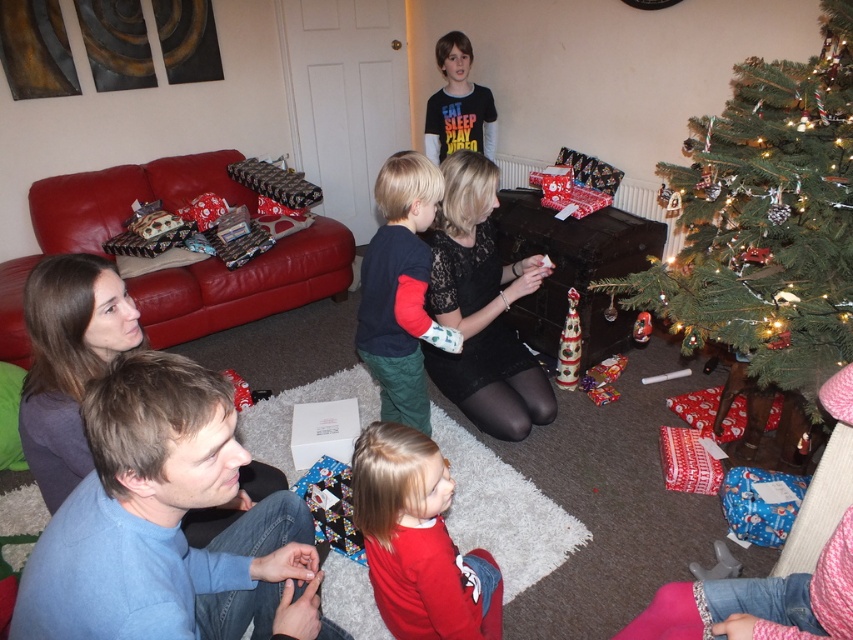
Question: Does matte red shirt at lower center have a smaller size compared to dark blue fleece shirt at center?

Choices:
 (A) yes
 (B) no

Answer: (A)

Question: Is green textured christmas tree at right positioned at the back of matte red shirt at lower center?

Choices:
 (A) yes
 (B) no

Answer: (A)

Question: Which point is closer to the camera?

Choices:
 (A) (467, 93)
 (B) (410, 262)
 (C) (685, 317)

Answer: (B)

Question: Which is nearer to the dark blue fleece shirt at center?

Choices:
 (A) green textured christmas tree at right
 (B) matte red shirt at lower center
 (C) black matte shirt at upper center

Answer: (B)

Question: Which point is farther to the camera?

Choices:
 (A) green textured christmas tree at right
 (B) dark blue fleece shirt at center
 (C) black matte shirt at upper center

Answer: (C)

Question: Can you confirm if blue cotton shirt at lower left is wider than dark blue fleece shirt at center?

Choices:
 (A) yes
 (B) no

Answer: (A)